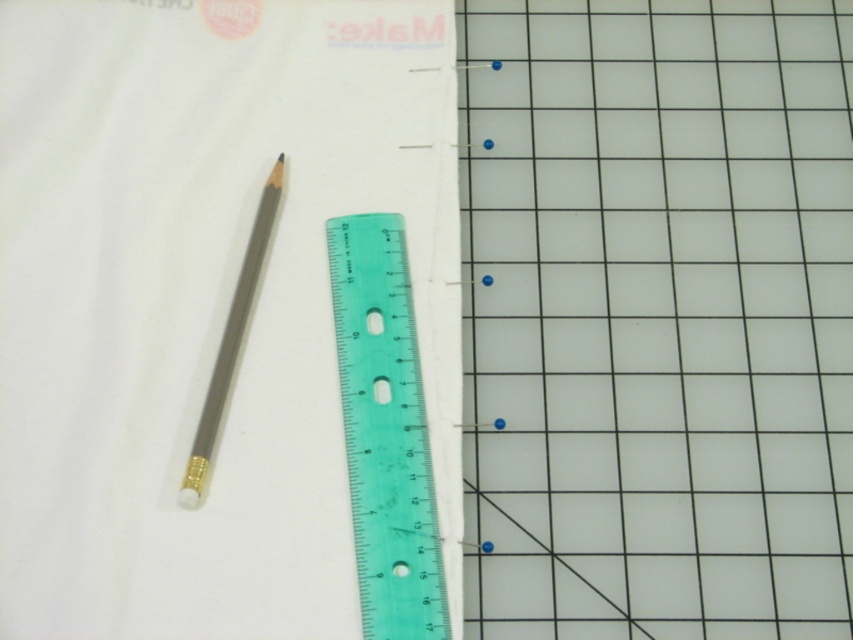
Consider the image. Does white matte cloth at upper left appear over matte gray pencil at center-left?

Yes.

Which is below, white matte cloth at upper left or matte gray pencil at center-left?

matte gray pencil at center-left is lower down.

Is point (51, 305) behind point (204, 481)?

Yes, point (51, 305) is behind point (204, 481).

Where is `white matte cloth at upper left`? This screenshot has height=640, width=853. white matte cloth at upper left is located at coordinates (206, 301).

Is green plastic ruler at center-left in front of matte gray pencil at center-left?

That is True.

Describe the element at coordinates (386, 429) in the screenshot. The image size is (853, 640). I see `green plastic ruler at center-left` at that location.

At what (x,y) coordinates should I click in order to perform the action: click on green plastic ruler at center-left. Please return your answer as a coordinate pair (x, y). Looking at the image, I should click on (386, 429).

Based on the photo, can you confirm if transparent plastic grid at center is shorter than matte gray pencil at center-left?

Incorrect, transparent plastic grid at center's height does not fall short of matte gray pencil at center-left's.

Does transparent plastic grid at center have a greater height compared to matte gray pencil at center-left?

Indeed, transparent plastic grid at center has a greater height compared to matte gray pencil at center-left.

Does point (672, 44) come behind point (256, 268)?

Yes, point (672, 44) is farther from viewer.

Find the location of a particular element. The image size is (853, 640). transparent plastic grid at center is located at coordinates (657, 317).